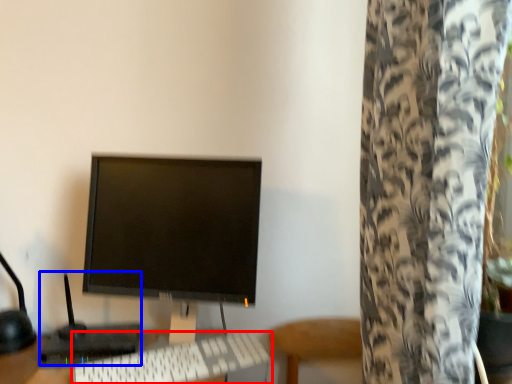
Question: Which object appears closest to the camera in this image, computer keyboard (highlighted by a red box) or computer (highlighted by a blue box)?

Choices:
 (A) computer keyboard
 (B) computer

Answer: (A)